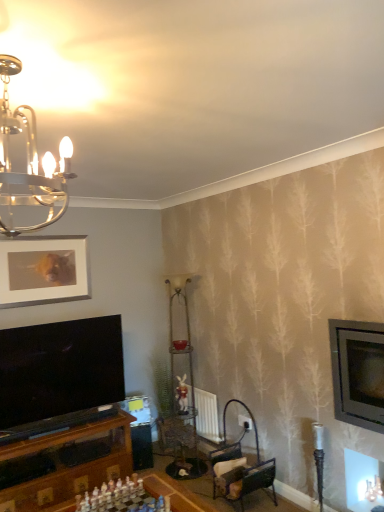
Question: Can you confirm if metallic dark brown chair at lower center is positioned to the right of metallic chandelier at upper left?

Choices:
 (A) yes
 (B) no

Answer: (A)

Question: Is metallic dark brown chair at lower center bigger than metallic chandelier at upper left?

Choices:
 (A) yes
 (B) no

Answer: (B)

Question: Is metallic chandelier at upper left a part of metallic dark brown chair at lower center?

Choices:
 (A) yes
 (B) no

Answer: (B)

Question: Does metallic dark brown chair at lower center appear on the left side of metallic chandelier at upper left?

Choices:
 (A) no
 (B) yes

Answer: (A)

Question: Is metallic dark brown chair at lower center oriented away from metallic chandelier at upper left?

Choices:
 (A) yes
 (B) no

Answer: (B)

Question: Relative to metallic dark brown chair at lower center, is matte plastic rabbit at center in front or behind?

Choices:
 (A) front
 (B) behind

Answer: (B)

Question: Is matte plastic rabbit at center inside or outside of metallic dark brown chair at lower center?

Choices:
 (A) inside
 (B) outside

Answer: (B)

Question: Visually, is matte plastic rabbit at center positioned to the left or to the right of metallic dark brown chair at lower center?

Choices:
 (A) right
 (B) left

Answer: (B)

Question: Is point (180, 379) positioned closer to the camera than point (271, 477)?

Choices:
 (A) closer
 (B) farther

Answer: (B)

Question: In the image, is metallic dark brown chair at lower center positioned in front of or behind matte white picture frame at upper left?

Choices:
 (A) front
 (B) behind

Answer: (A)

Question: In the image, is metallic dark brown chair at lower center on the left side or the right side of matte white picture frame at upper left?

Choices:
 (A) left
 (B) right

Answer: (B)

Question: Looking at their shapes, would you say metallic dark brown chair at lower center is wider or thinner than matte white picture frame at upper left?

Choices:
 (A) thin
 (B) wide

Answer: (B)

Question: Is point (268, 460) positioned closer to the camera than point (38, 256)?

Choices:
 (A) farther
 (B) closer

Answer: (B)

Question: Based on their positions, is metallic chandelier at upper left located to the left or right of metallic dark brown chair at lower center?

Choices:
 (A) left
 (B) right

Answer: (A)

Question: Does point (21, 192) appear closer or farther from the camera than point (220, 450)?

Choices:
 (A) closer
 (B) farther

Answer: (A)